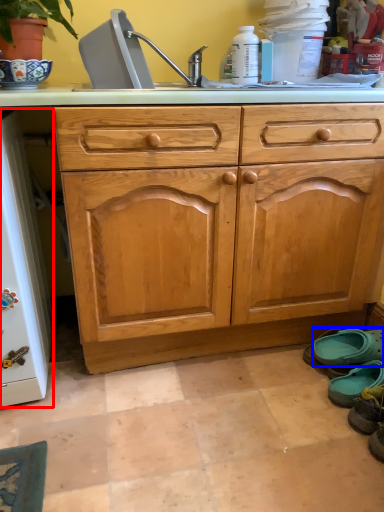
Question: Among these objects, which one is nearest to the camera, appliance (highlighted by a red box) or footwear (highlighted by a blue box)?

Choices:
 (A) appliance
 (B) footwear

Answer: (A)